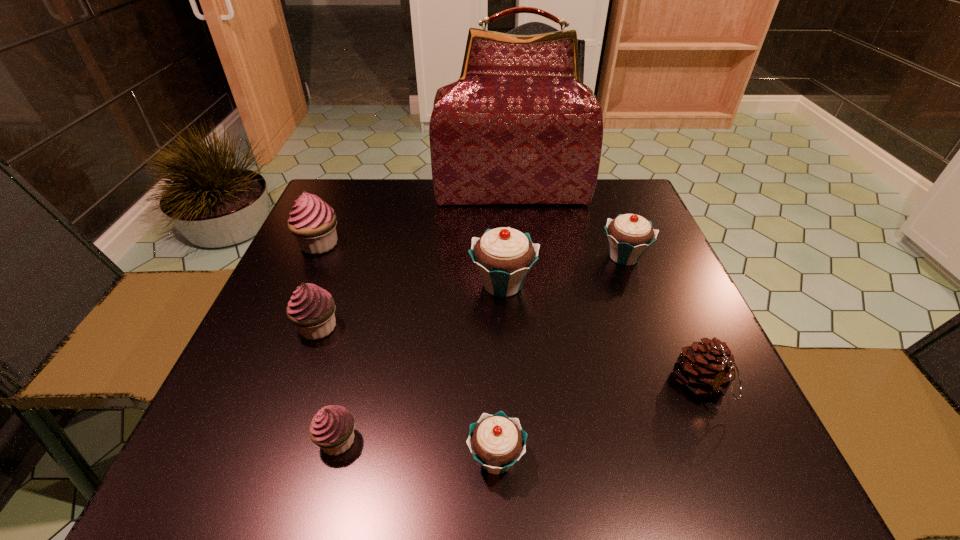
The height and width of the screenshot is (540, 960). Identify the location of vacant region at the far left corner of the desktop. (340, 224).

Where is `free region at the near right corner`? The height and width of the screenshot is (540, 960). free region at the near right corner is located at coordinates (769, 463).

Locate an element on the screen. vacant area that lies between the third object from left to right and the smallest teal cupcake is located at coordinates (417, 449).

This screenshot has width=960, height=540. Identify the location of empty location between the nearest teal cupcake and the third nearest object. (598, 422).

At what (x,y) coordinates should I click in order to perform the action: click on free spot between the nearest pink cupcake and the biggest pink cupcake. Please return your answer as a coordinate pair (x, y). The width and height of the screenshot is (960, 540). Looking at the image, I should click on (328, 342).

Locate an element on the screen. vacant area that lies between the sixth farthest object and the biggest pink cupcake is located at coordinates pos(510,315).

You are a GUI agent. You are given a task and a screenshot of the screen. Output one action in this format:
    pyautogui.click(x=<x>, y=<y>)
    Task: Click on the unoccupied position between the biggest pink cupcake and the nearest teal cupcake
    Image resolution: width=960 pixels, height=540 pixels.
    Given the screenshot: What is the action you would take?
    pyautogui.click(x=408, y=352)

Identify the location of free space between the tallest object and the nearest teal cupcake. (504, 326).

Where is `blank region between the biggest pink cupcake and the smallest teal cupcake`? Image resolution: width=960 pixels, height=540 pixels. blank region between the biggest pink cupcake and the smallest teal cupcake is located at coordinates (408, 352).

You are a GUI agent. You are given a task and a screenshot of the screen. Output one action in this format:
    pyautogui.click(x=<x>, y=<y>)
    Task: Click on the empty space that is in between the biggest teal cupcake and the rightmost pink cupcake
    The width and height of the screenshot is (960, 540).
    Given the screenshot: What is the action you would take?
    pos(420,362)